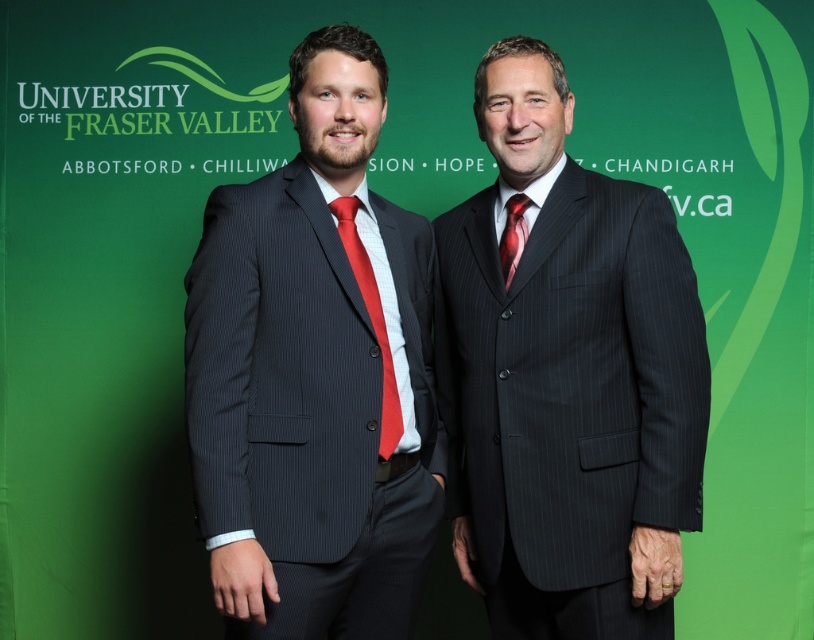
In the scene shown: You are a photographer who needs to adjust the lighting between the matte pinstripe suit at center and the red silk tie at center. Which object is positioned to the left of the other?

The matte pinstripe suit at center is to the left of the red silk tie at center.

You are a photographer who needs to adjust the lighting for a group photo. You have two light sources placed at the points labeled as point 1 and point 2. Point 1 is at coordinate point (322, 493) and point 2 is at coordinate point (364, 280). Based on their positions, which light source is closer to the camera?

Point 1 at coordinate point (322, 493) is in front of point 2 at coordinate point (364, 280), so the light source at point 1 is closer to the camera.